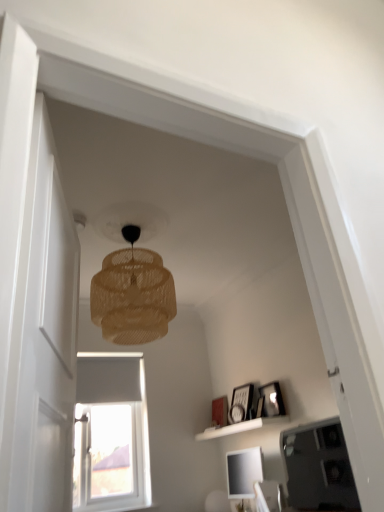
Question: Does wooden picture frame at upper right, placed as the first picture frame when sorted from front to back, have a smaller size compared to white matte shelf at lower center?

Choices:
 (A) yes
 (B) no

Answer: (A)

Question: From the image's perspective, is wooden picture frame at upper right, placed as the 3th picture frame when sorted from back to front, beneath white matte shelf at lower center?

Choices:
 (A) yes
 (B) no

Answer: (B)

Question: Does wooden picture frame at upper right, acting as the 3th picture frame starting from the left, appear on the left side of white matte shelf at lower center?

Choices:
 (A) no
 (B) yes

Answer: (A)

Question: From the image's perspective, would you say wooden picture frame at upper right, placed as the first picture frame when sorted from front to back, is positioned over white matte shelf at lower center?

Choices:
 (A) no
 (B) yes

Answer: (B)

Question: Does wooden picture frame at upper right, positioned as the 1th picture frame in right-to-left order, lie in front of white matte shelf at lower center?

Choices:
 (A) yes
 (B) no

Answer: (B)

Question: Considering the relative sizes of wooden picture frame at upper right, placed as the 3th picture frame when sorted from back to front, and white matte shelf at lower center in the image provided, is wooden picture frame at upper right, placed as the 3th picture frame when sorted from back to front, shorter than white matte shelf at lower center?

Choices:
 (A) yes
 (B) no

Answer: (B)

Question: Is white matte shelf at lower center wider than matte black picture frame at upper right, which is the second picture frame from back to front?

Choices:
 (A) no
 (B) yes

Answer: (B)

Question: Is white matte shelf at lower center aimed at matte black picture frame at upper right, which is the second picture frame from back to front?

Choices:
 (A) no
 (B) yes

Answer: (A)

Question: Is matte black picture frame at upper right, arranged as the 2th picture frame when viewed from the right, surrounded by white matte shelf at lower center?

Choices:
 (A) no
 (B) yes

Answer: (A)

Question: From a real-world perspective, is white matte shelf at lower center on matte black picture frame at upper right, arranged as the 2th picture frame when viewed from the left?

Choices:
 (A) no
 (B) yes

Answer: (A)

Question: Is white matte shelf at lower center turned away from matte black picture frame at upper right, arranged as the 2th picture frame when viewed from the left?

Choices:
 (A) yes
 (B) no

Answer: (B)

Question: From the image's perspective, is white matte shelf at lower center located beneath matte black picture frame at upper right, which is the second picture frame from back to front?

Choices:
 (A) yes
 (B) no

Answer: (A)

Question: Can you confirm if matte white picture frame at center, the third picture frame positioned from the front, is thinner than white matte shelf at lower center?

Choices:
 (A) no
 (B) yes

Answer: (B)